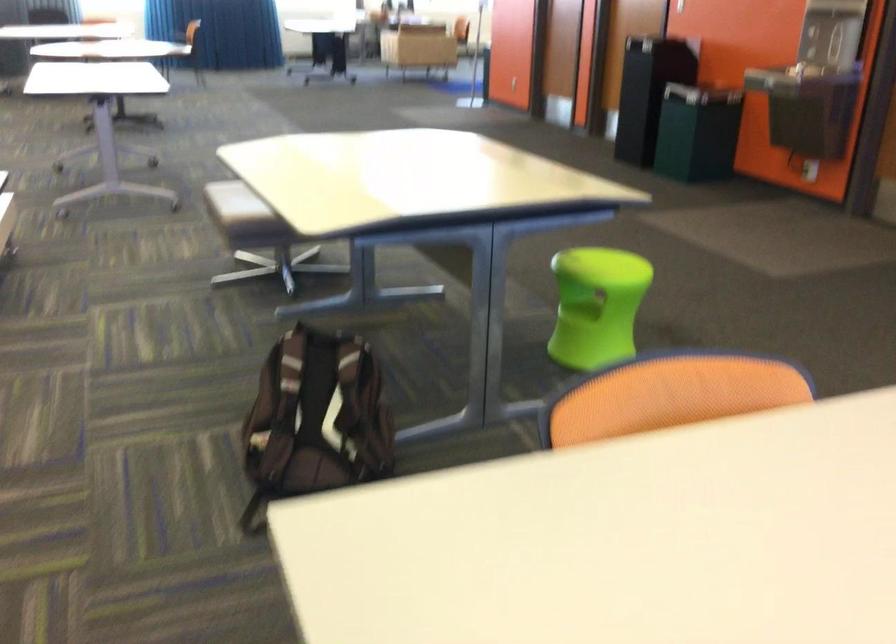
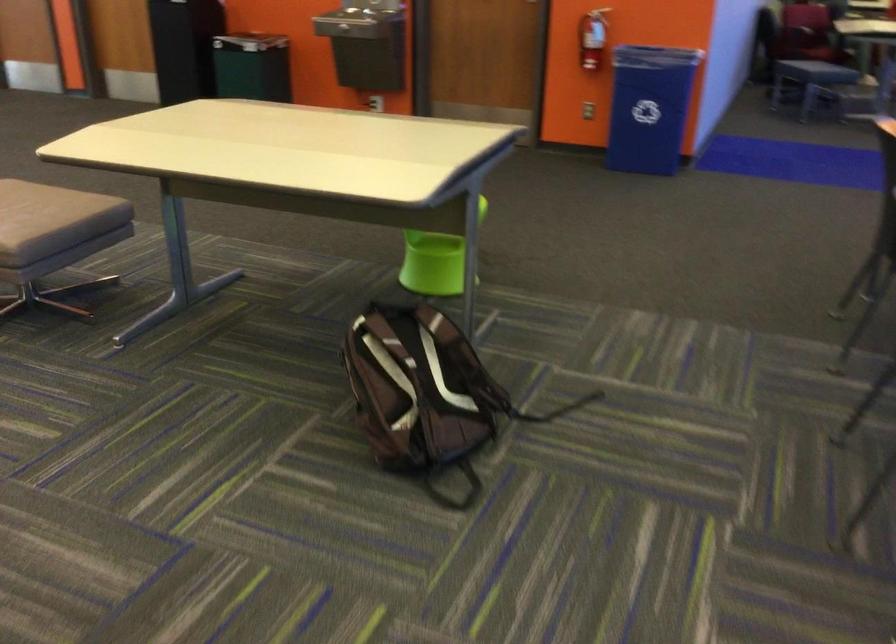
Locate, in the second image, the point that corresponds to [567,330] in the first image.

(435, 261)